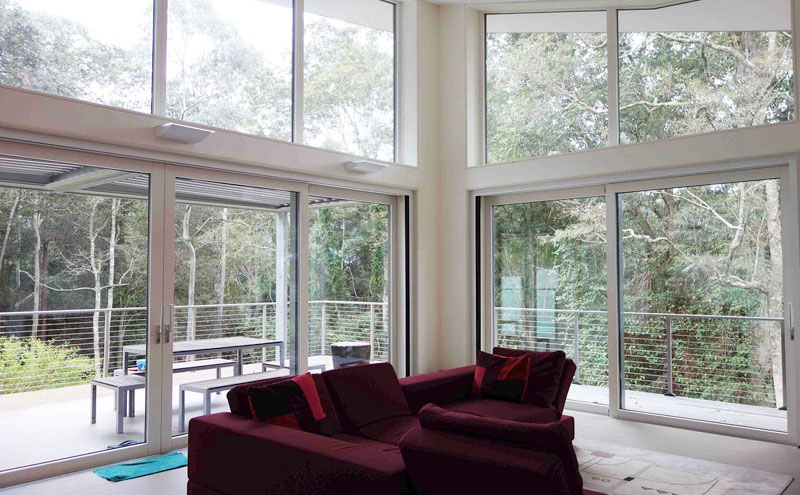
You are a GUI agent. You are given a task and a screenshot of the screen. Output one action in this format:
    pyautogui.click(x=<x>, y=<y>)
    Task: Click on the light
    The image size is (800, 495).
    Given the screenshot: What is the action you would take?
    pyautogui.click(x=176, y=134), pyautogui.click(x=362, y=166)